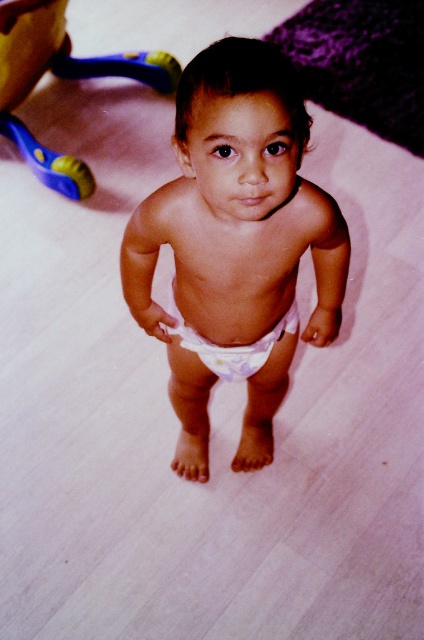
You are a parent trying to determine if your child can comfortably wear their white cloth diaper at center while using the blue plastic walker at upper left. Based on the image, can the diaper fit under the walker without being too bulky?

The white cloth diaper at center is thinner than the blue plastic walker at upper left, so it should fit comfortably under the walker without any bulkiness issues.

You are a parent trying to locate your child in a room. You see the white cloth diaper at center and the blue plastic walker at upper left. Which object is closer to the right side of the room?

The white cloth diaper at center is positioned on the right side of blue plastic walker at upper left, so the white cloth diaper at center is closer to the right side of the room.

The child is standing on a light colored wooden floor. There is a point at coordinates (236,246). What object is this point located on?

The point at (236,246) is located on the white cloth diaper at center.